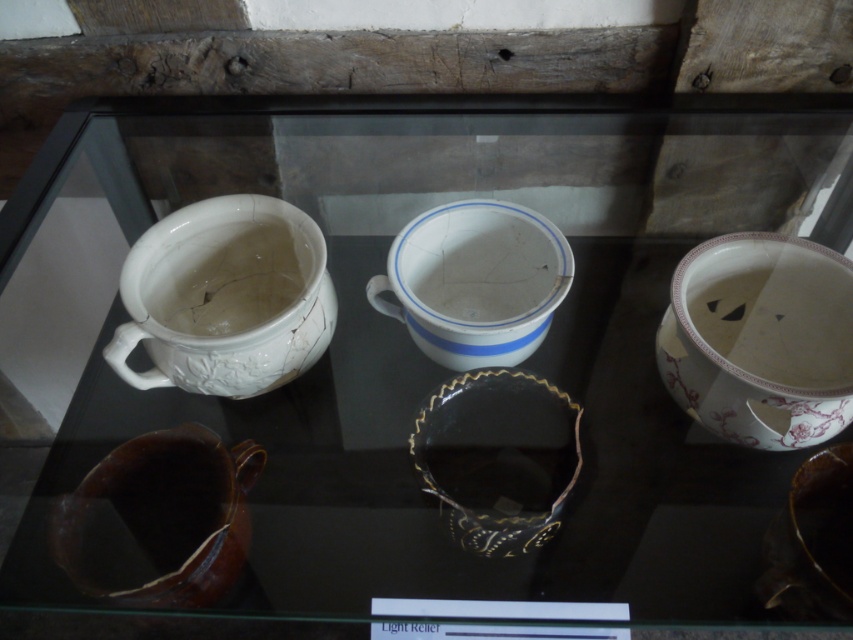
Question: Which point appears closest to the camera in this image?

Choices:
 (A) (392, 273)
 (B) (498, 493)
 (C) (822, 275)
 (D) (190, 275)

Answer: (B)

Question: Can you confirm if brown glazed pitcher at lower left is bigger than white matte teapot at upper left?

Choices:
 (A) no
 (B) yes

Answer: (B)

Question: Estimate the real-world distances between objects in this image. Which object is closer to the white glossy mug at upper left?

Choices:
 (A) white glossy mug at center
 (B) white porcelain mug at right
 (C) black glossy bowl at center

Answer: (A)

Question: Among these points, which one is nearest to the camera?

Choices:
 (A) click(x=825, y=417)
 (B) click(x=242, y=300)
 (C) click(x=283, y=212)

Answer: (A)

Question: Does white glossy mug at upper left lie in front of brown glazed pitcher at lower left?

Choices:
 (A) no
 (B) yes

Answer: (A)

Question: Is white porcelain mug at right in front of black glossy bowl at center?

Choices:
 (A) no
 (B) yes

Answer: (A)